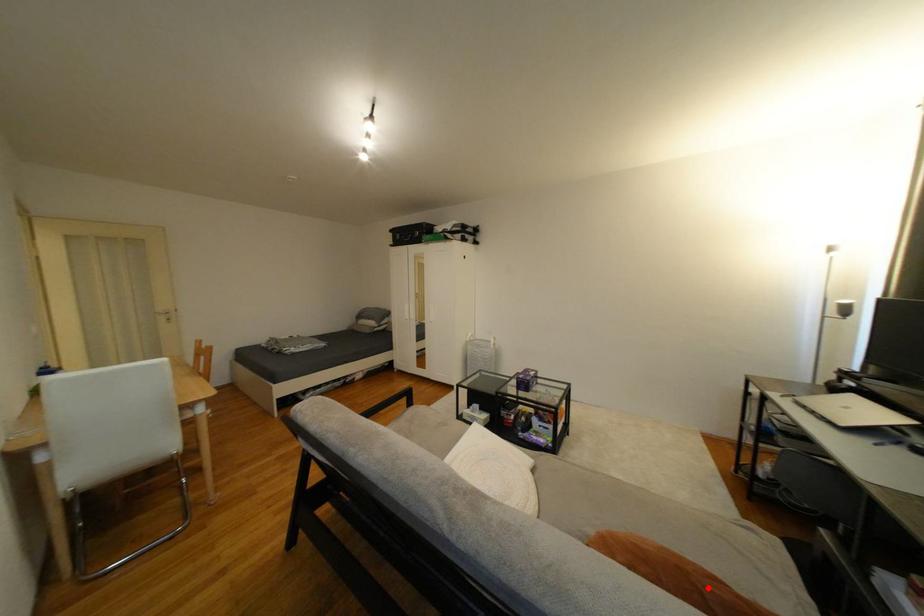
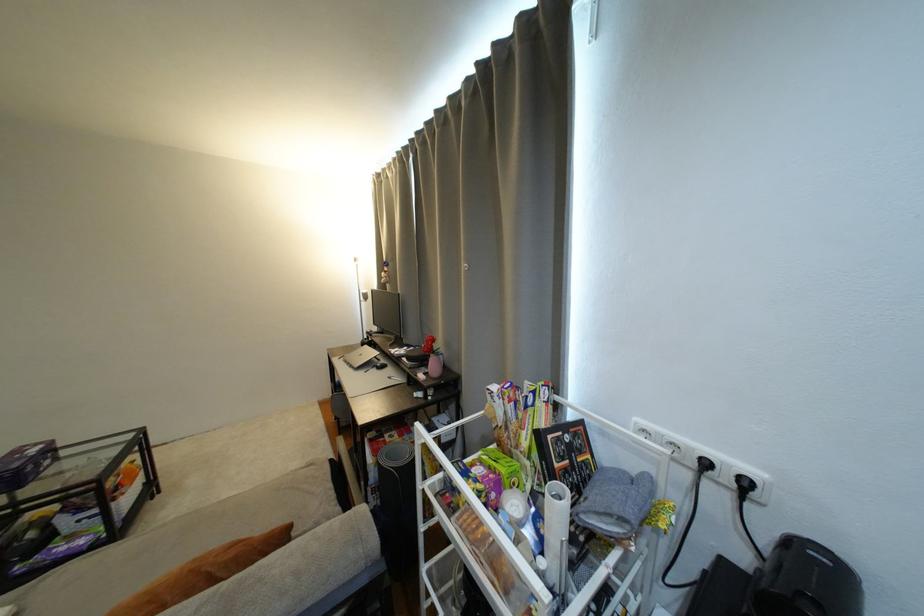
In the second image, find the point that corresponds to the highlighted location in the first image.

(216, 570)